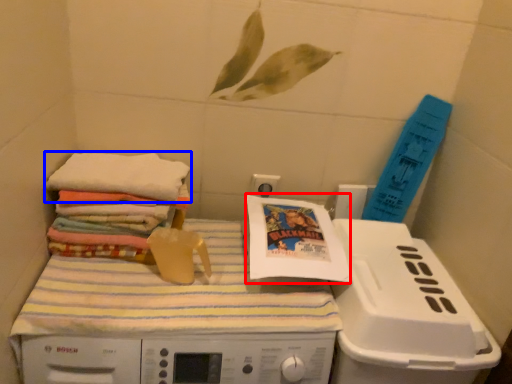
Question: Which object is closer to the camera taking this photo, comic book (highlighted by a red box) or towel (highlighted by a blue box)?

Choices:
 (A) comic book
 (B) towel

Answer: (B)